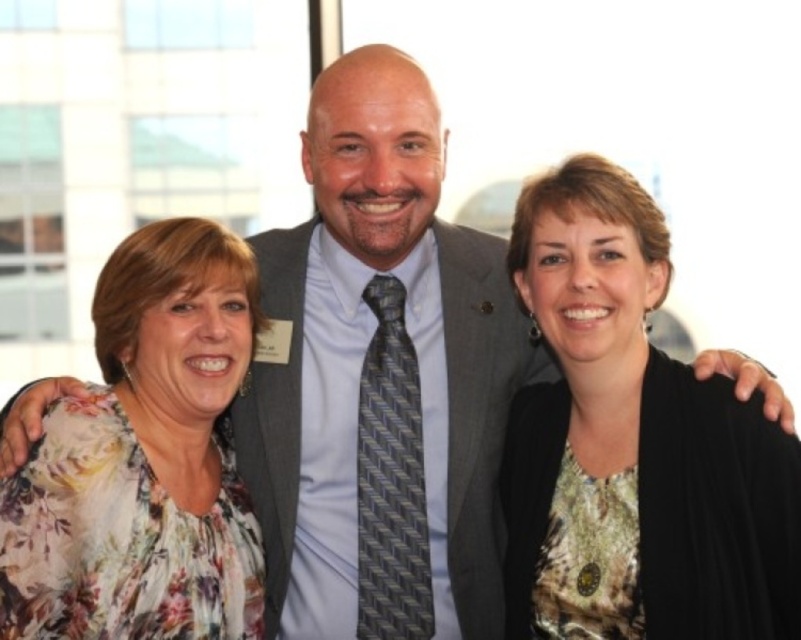
Question: Which point appears farthest from the camera in this image?

Choices:
 (A) (655, 506)
 (B) (166, 504)

Answer: (B)

Question: Which object is positioned farthest from the floral fabric blouse at center?

Choices:
 (A) gray textured suit at center
 (B) floral fabric blouse at left

Answer: (B)

Question: Which object appears farthest from the camera in this image?

Choices:
 (A) floral fabric blouse at left
 (B) gray textured suit at center
 (C) floral fabric blouse at center

Answer: (B)

Question: Is floral fabric blouse at center positioned before gray textured suit at center?

Choices:
 (A) no
 (B) yes

Answer: (B)

Question: Does floral fabric blouse at center appear over floral fabric blouse at left?

Choices:
 (A) yes
 (B) no

Answer: (A)

Question: Can you confirm if floral fabric blouse at center is wider than floral fabric blouse at left?

Choices:
 (A) yes
 (B) no

Answer: (A)